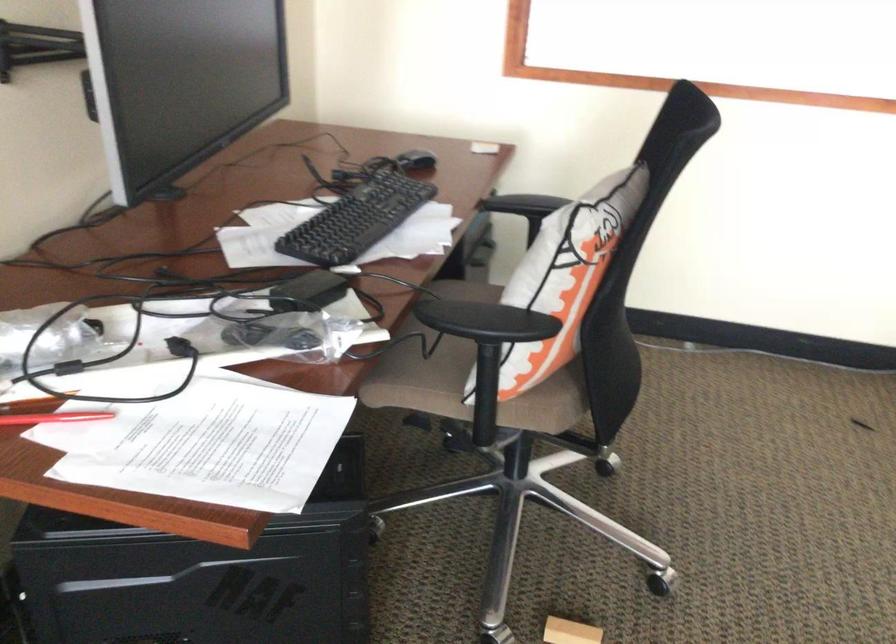
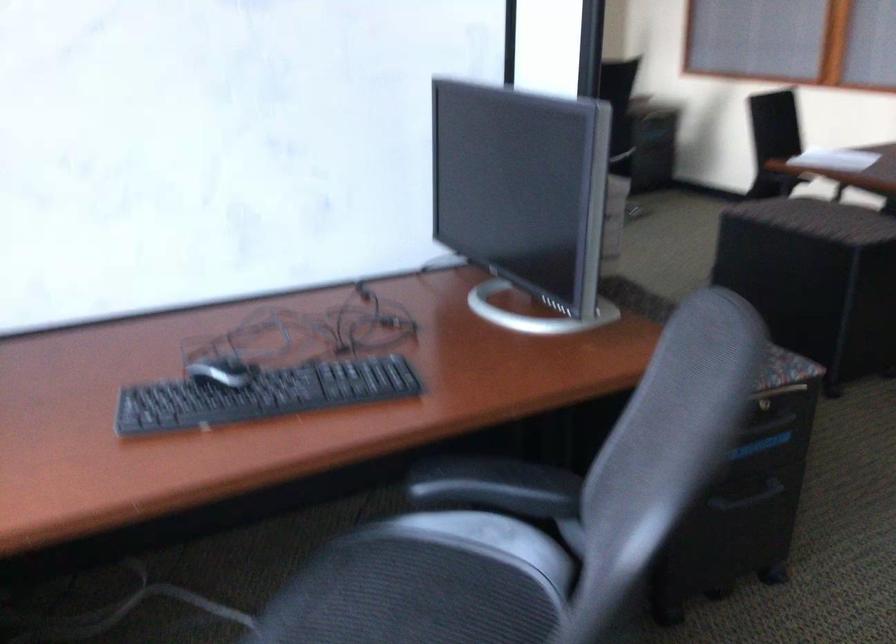
Question: I am providing you with two images of the same scene from different viewpoints. Please identify which objects are invisible in image2.

Choices:
 (A) computer mouse
 (B) small white pillow
 (C) chair sitting surface
 (D) black chair armrest

Answer: (C)